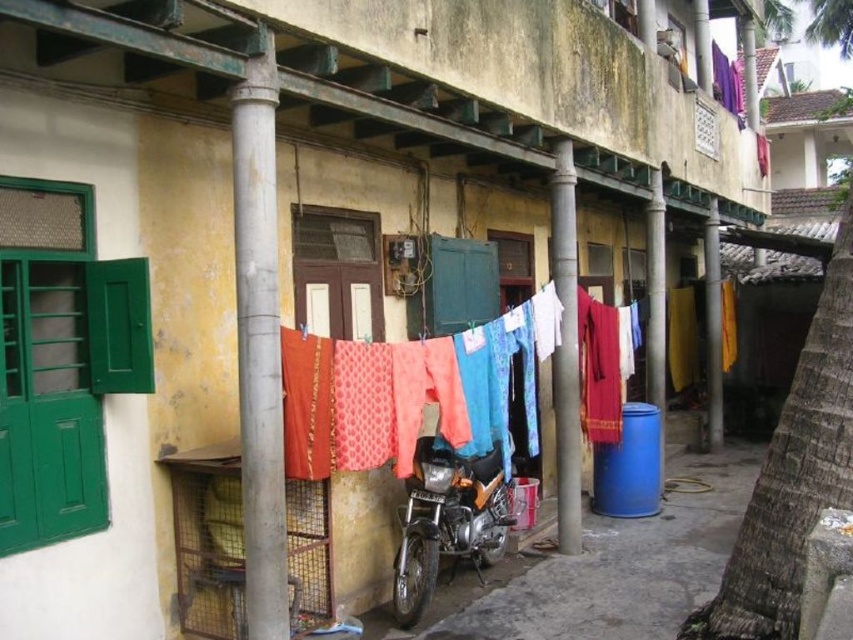
Question: Considering the real-world distances, which object is closest to the patterned fabric clothes at center?

Choices:
 (A) shiny metallic motorcycle at center
 (B) gray concrete pillar at center
 (C) yellow fabric at right

Answer: (B)

Question: Is patterned fabric clothes at center to the right of shiny metallic motorcycle at center from the viewer's perspective?

Choices:
 (A) yes
 (B) no

Answer: (B)

Question: Which point is closer to the camera taking this photo?

Choices:
 (A) (236, 113)
 (B) (570, 358)

Answer: (A)

Question: Does smooth concrete pole at center appear under yellow fabric at right?

Choices:
 (A) yes
 (B) no

Answer: (A)

Question: Does shiny metallic motorcycle at center have a lesser width compared to smooth concrete pole at center?

Choices:
 (A) no
 (B) yes

Answer: (A)

Question: Which of the following is the closest to the observer?

Choices:
 (A) patterned fabric clothes at center
 (B) shiny metallic motorcycle at center
 (C) yellow fabric at right

Answer: (A)